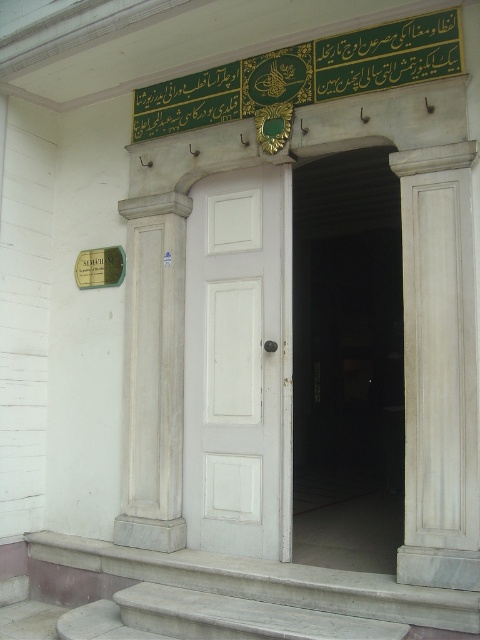
Can you confirm if white wooden door at center is wider than green metallic plaque at left?

Yes.

Measure the distance from white wooden door at center to green metallic plaque at left.

white wooden door at center and green metallic plaque at left are 2.64 meters apart from each other.

Is point (311, 356) more distant than point (106, 257)?

Yes, it is.

Where is `white wooden door at center`? The width and height of the screenshot is (480, 640). white wooden door at center is located at coordinates (348, 362).

Does white marble column at left have a larger size compared to green metallic plaque at left?

Indeed, white marble column at left has a larger size compared to green metallic plaque at left.

The height and width of the screenshot is (640, 480). What are the coordinates of `white marble column at left` in the screenshot? It's located at (153, 372).

Who is more distant from viewer, (145, 225) or (121, 257)?

Positioned behind is point (121, 257).

Where is `white marble column at left`? The height and width of the screenshot is (640, 480). white marble column at left is located at coordinates (153, 372).

Is white marble column at right taller than gray marble stairs at lower left?

Yes.

Which is above, white marble column at right or gray marble stairs at lower left?

white marble column at right is higher up.

Locate an element on the screen. The height and width of the screenshot is (640, 480). white marble column at right is located at coordinates (439, 369).